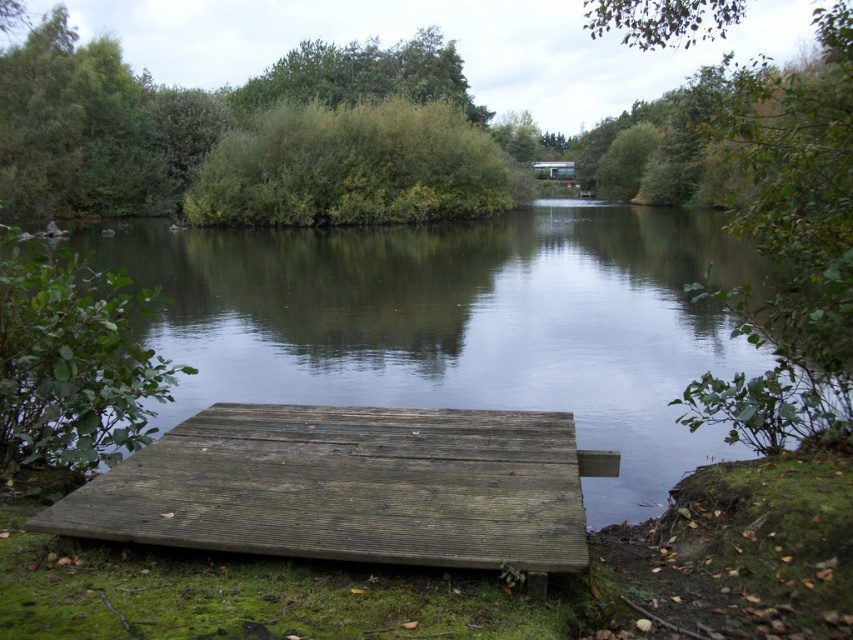
You are standing on the grassy bank near the weathered wood dock at lower center and the green leafy bush at center. Which object is closer to the water?

The weathered wood dock at lower center is closer to the water because it is located below the green leafy bush at center, meaning it is positioned lower and nearer to the water body.